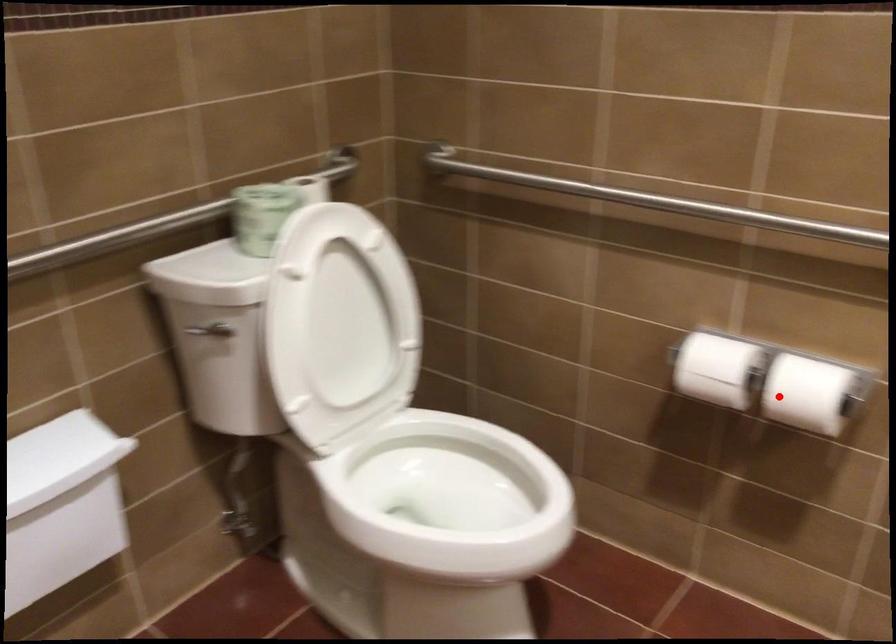
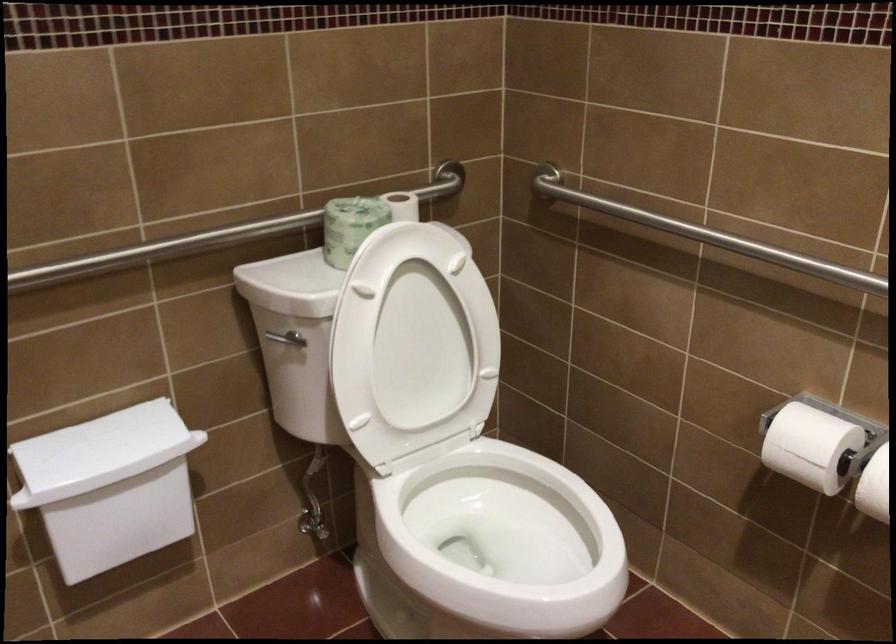
Where in the second image is the point corresponding to the highlighted location from the first image?

(874, 486)